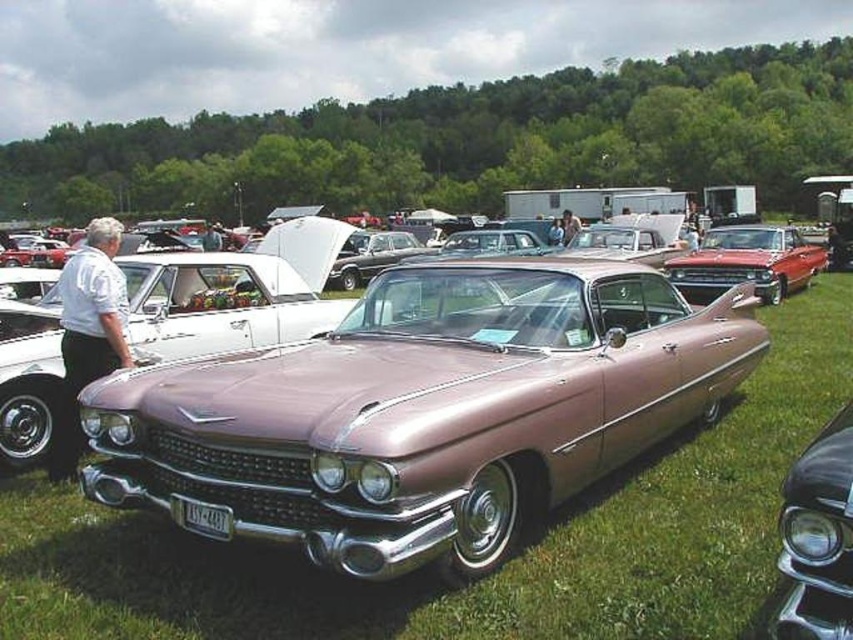
Looking at this image, you are a photographer positioned at point 0.5, 0.5 in the image coordinate system. You want to capture a photo of the metallic purple car at center. What is the direction you should move to get closer to the car?

The metallic purple car at center is located at point (x=422, y=410). Since you are at (x=426, y=320), you should move northeast to reach the car.

You are a photographer trying to capture the metallic purple car at center and the glossy black headlight at lower right in a single frame. Based on their positions, which object should you focus on first to ensure both are in the shot?

The metallic purple car at center is above the glossy black headlight at lower right, so you should focus on the glossy black headlight at lower right first to ensure both are in the shot.

You are standing in the middle of the grassy field at the classic car show. There is a shiny metallic purple vintage Cadillac in the foreground. You notice a point at coordinates (817, 538). Can you determine what object this point is located on?

The point at coordinates (817, 538) is located on the glossy black headlight at lower right.